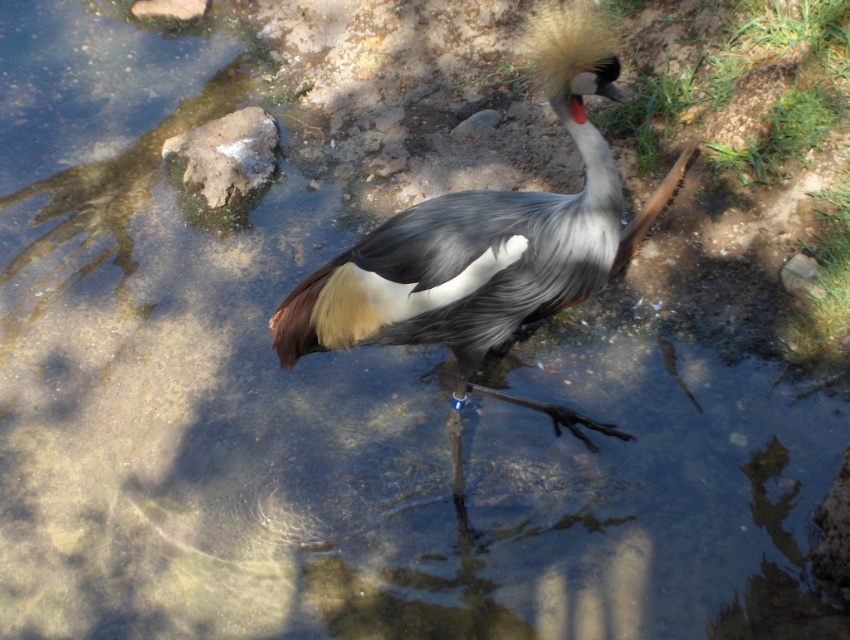
Locate an element on the screen. This screenshot has height=640, width=850. gray feathered bird at center is located at coordinates (488, 243).

Is point (599, 77) in front of point (796, 278)?

Yes, point (599, 77) is closer to viewer.

Image resolution: width=850 pixels, height=640 pixels. What are the coordinates of `gray feathered bird at center` in the screenshot? It's located at (488, 243).

Is smooth gray rock at upper left taller than smooth beige rock at upper left?

Indeed, smooth gray rock at upper left has a greater height compared to smooth beige rock at upper left.

Between point (233, 184) and point (197, 10), which one is positioned in front?

Point (233, 184)

Identify the location of smooth gray rock at upper left. (225, 156).

Is smooth gray rock at upper left shorter than gray rock at lower right?

In fact, smooth gray rock at upper left may be taller than gray rock at lower right.

You are a GUI agent. You are given a task and a screenshot of the screen. Output one action in this format:
    pyautogui.click(x=<x>, y=<y>)
    Task: Click on the smooth gray rock at upper left
    The height and width of the screenshot is (640, 850).
    Given the screenshot: What is the action you would take?
    pyautogui.click(x=225, y=156)

Locate an element on the screen. smooth gray rock at upper left is located at coordinates (225, 156).